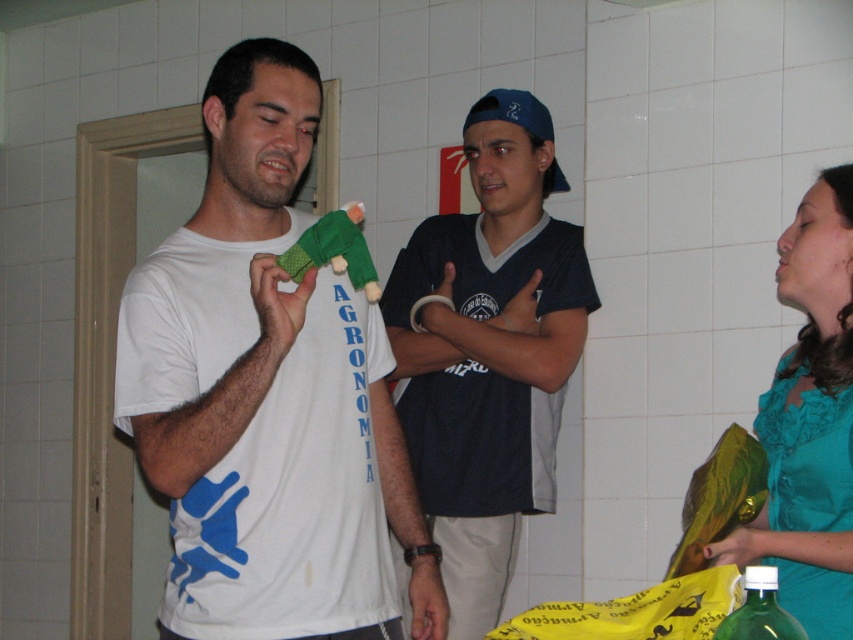
Is teal satin blouse at right to the right of green matte bottle at lower right from the viewer's perspective?

Yes, teal satin blouse at right is to the right of green matte bottle at lower right.

Between teal satin blouse at right and green matte bottle at lower right, which one is positioned lower?

green matte bottle at lower right is lower down.

Identify the location of teal satin blouse at right. (809, 422).

Can you confirm if white matte t-shirt at center is shorter than green matte bottle at lower right?

In fact, white matte t-shirt at center may be taller than green matte bottle at lower right.

What are the coordinates of `white matte t-shirt at center` in the screenshot? It's located at (267, 396).

Is point (479, 593) closer to viewer compared to point (837, 193)?

No.

Who is more distant from viewer, (x=515, y=349) or (x=787, y=493)?

The point (x=515, y=349) is behind.

Image resolution: width=853 pixels, height=640 pixels. In order to click on dark blue jersey at center in this screenshot , I will do `click(488, 352)`.